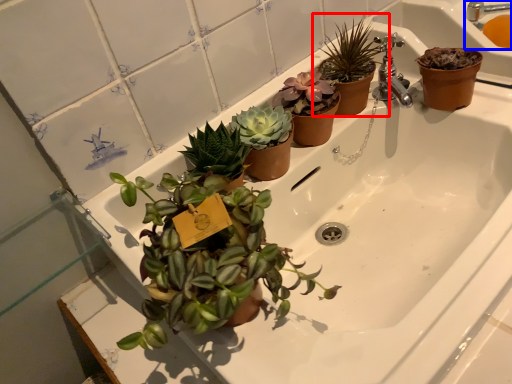
Question: Which point is further to the camera, houseplant (highlighted by a red box) or sink (highlighted by a blue box)?

Choices:
 (A) houseplant
 (B) sink

Answer: (B)